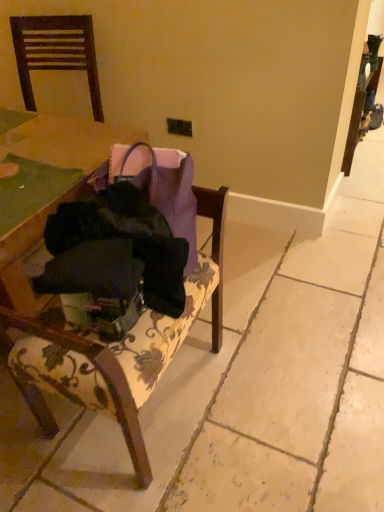
Question: Would you say black fabric bag at center is to the left or to the right of velvet floral-patterned chair at center, which is counted as the 1th chair, starting from the right, in the picture?

Choices:
 (A) right
 (B) left

Answer: (A)

Question: From a real-world perspective, is black fabric bag at center positioned above or below velvet floral-patterned chair at center, the 1th chair from the bottom?

Choices:
 (A) below
 (B) above

Answer: (B)

Question: Estimate the real-world distances between objects in this image. Which object is farther from the velvet floral-patterned chair at center, which appears as the 2th chair when viewed from the top?

Choices:
 (A) dark wood chair at upper left, acting as the 2th chair starting from the right
 (B) black fabric bag at center

Answer: (A)

Question: Estimate the real-world distances between objects in this image. Which object is farther from the dark wood chair at upper left, which appears as the second chair when ordered from the bottom?

Choices:
 (A) velvet floral-patterned chair at center, which appears as the 2th chair when viewed from the top
 (B) black fabric bag at center

Answer: (B)